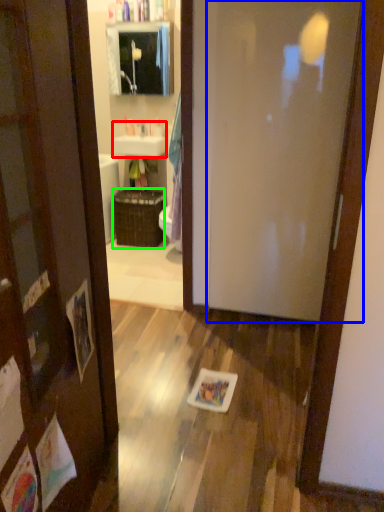
Question: Which is nearer to the sink (highlighted by a red box)? door (highlighted by a blue box) or basket (highlighted by a green box).

Choices:
 (A) door
 (B) basket

Answer: (B)